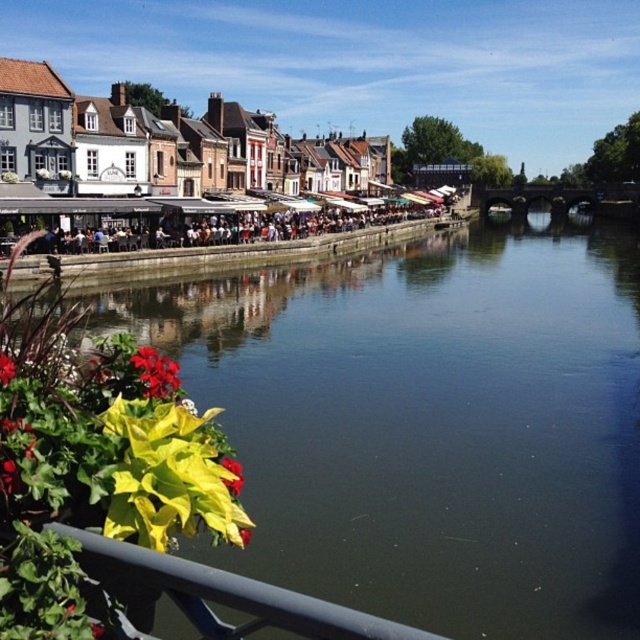
You are standing at the riverside and want to determine which of the two points, point (611, 452) or point (241, 468), is closer to you. Based on the scene description, which point is nearer?

Point (611, 452) is closer to you because it is further to the viewer than point (241, 468).